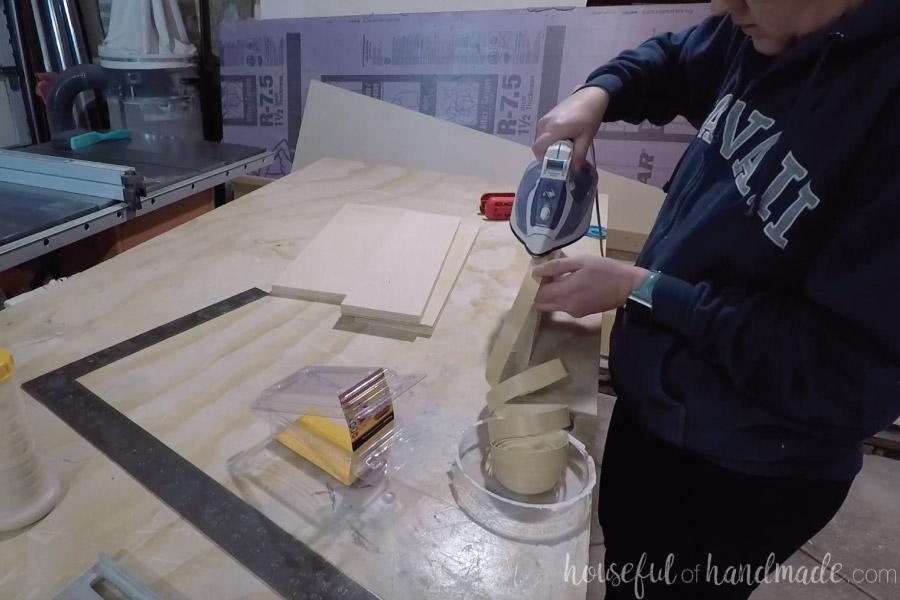
Find the location of `bottle`. bottle is located at coordinates (32, 484).